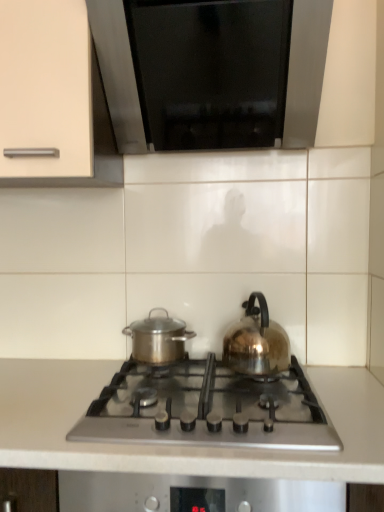
What do you see at coordinates (179, 446) in the screenshot?
I see `white matte countertop at center` at bounding box center [179, 446].

Locate an element on the screen. This screenshot has height=512, width=384. translucent glass kettle at right is located at coordinates (256, 341).

This screenshot has height=512, width=384. Describe the element at coordinates (158, 338) in the screenshot. I see `stainless steel pot at center` at that location.

The height and width of the screenshot is (512, 384). Find the location of `white matte countertop at center`. white matte countertop at center is located at coordinates (179, 446).

Between point (251, 325) and point (138, 375), which one is positioned in front?

Point (138, 375)

From the image's perspective, which is above, translucent glass kettle at right or satin silver gas stove at center?

translucent glass kettle at right is shown above in the image.

Considering the relative positions of translucent glass kettle at right and satin silver gas stove at center in the image provided, is translucent glass kettle at right to the right of satin silver gas stove at center from the viewer's perspective?

Correct, you'll find translucent glass kettle at right to the right of satin silver gas stove at center.

Is translucent glass kettle at right bigger or smaller than satin silver gas stove at center?

In the image, translucent glass kettle at right appears to be smaller than satin silver gas stove at center.

Can you confirm if white matte countertop at center is taller than translucent glass kettle at right?

Correct, white matte countertop at center is much taller as translucent glass kettle at right.

The image size is (384, 512). Find the location of `countertop that is below the translucent glass kettle at right (from the image's perspective)`. countertop that is below the translucent glass kettle at right (from the image's perspective) is located at coordinates (179, 446).

Looking at this image, measure the distance between white matte countertop at center and translucent glass kettle at right.

A distance of 11.67 inches exists between white matte countertop at center and translucent glass kettle at right.

In terms of width, does white matte countertop at center look wider or thinner when compared to translucent glass kettle at right?

In the image, white matte countertop at center appears to be wider than translucent glass kettle at right.

Which object is thinner, satin silver gas stove at center or white matte countertop at center?

With smaller width is satin silver gas stove at center.

Is satin silver gas stove at center behind white matte countertop at center?

Yes, satin silver gas stove at center is further from the camera.

From a real-world perspective, is satin silver gas stove at center located higher than white matte countertop at center?

Yes, from a real-world perspective, satin silver gas stove at center is over white matte countertop at center

Is satin silver gas stove at center bigger than white matte countertop at center?

No.

Can you tell me how much white matte countertop at center and stainless steel pot at center differ in facing direction?

The angle between the facing direction of white matte countertop at center and the facing direction of stainless steel pot at center is 0.628 degrees.

Does white matte countertop at center have a lesser width compared to stainless steel pot at center?

Incorrect, the width of white matte countertop at center is not less than that of stainless steel pot at center.

Where is `kitchen appliance lying above the white matte countertop at center (from the image's perspective)`? This screenshot has height=512, width=384. kitchen appliance lying above the white matte countertop at center (from the image's perspective) is located at coordinates (158, 338).

Does white matte countertop at center appear on the left side of stainless steel pot at center?

Yes.

Is stainless steel pot at center oriented away from white matte countertop at center?

No, white matte countertop at center is not at the back of stainless steel pot at center.

Which object is further away from the camera, stainless steel pot at center or white matte countertop at center?

stainless steel pot at center is further from the camera.

Does stainless steel pot at center have a lesser height compared to white matte countertop at center?

Indeed, stainless steel pot at center has a lesser height compared to white matte countertop at center.

Does point (345, 406) come behind point (120, 425)?

Yes.

From the picture: How many degrees apart are the facing directions of white matte countertop at center and satin silver gas stove at center?

The angular difference between white matte countertop at center and satin silver gas stove at center is 0.531 degrees.

Consider the image. Is white matte countertop at center wider or thinner than satin silver gas stove at center?

white matte countertop at center is wider than satin silver gas stove at center.

Locate an element on the screen. Image resolution: width=384 pixels, height=512 pixels. kettle lying behind the satin silver gas stove at center is located at coordinates tap(256, 341).

Looking at this image, from the image's perspective, is satin silver gas stove at center on translucent glass kettle at right?

No, from the image's perspective, satin silver gas stove at center is not above translucent glass kettle at right.

Is satin silver gas stove at center far from translucent glass kettle at right?

satin silver gas stove at center is actually quite close to translucent glass kettle at right.

Image resolution: width=384 pixels, height=512 pixels. I want to click on kettle above the satin silver gas stove at center (from the image's perspective), so click(x=256, y=341).

The height and width of the screenshot is (512, 384). Find the location of `kettle that is on the right side of white matte countertop at center`. kettle that is on the right side of white matte countertop at center is located at coordinates (256, 341).

When comparing their distances from white matte countertop at center, does translucent glass kettle at right or satin silver gas stove at center seem closer?

satin silver gas stove at center.

Estimate the real-world distances between objects in this image. Which object is closer to black glass at upper center, translucent glass kettle at right or satin silver gas stove at center?

The object closer to black glass at upper center is translucent glass kettle at right.

Which object lies nearer to the anchor point satin silver gas stove at center, black glass at upper center or stainless steel pot at center?

stainless steel pot at center.

From the image, which object appears to be nearer to stainless steel pot at center, white matte countertop at center or translucent glass kettle at right?

The object closer to stainless steel pot at center is translucent glass kettle at right.

Considering their positions, is satin silver gas stove at center positioned closer to black glass at upper center than white matte countertop at center?

The object closer to black glass at upper center is satin silver gas stove at center.

Looking at the image, which one is located further to stainless steel pot at center, translucent glass kettle at right or black glass at upper center?

The object further to stainless steel pot at center is black glass at upper center.

Estimate the real-world distances between objects in this image. Which object is closer to satin silver gas stove at center, white matte countertop at center or black glass at upper center?

Among the two, white matte countertop at center is located nearer to satin silver gas stove at center.

Based on their spatial positions, is black glass at upper center or stainless steel pot at center closer to white matte countertop at center?

stainless steel pot at center.

What are the coordinates of `kettle between black glass at upper center and satin silver gas stove at center vertically` in the screenshot? It's located at (256, 341).

Identify the location of kitchen appliance between translucent glass kettle at right and white matte countertop at center in the up-down direction. (158, 338).

You are a GUI agent. You are given a task and a screenshot of the screen. Output one action in this format:
    pyautogui.click(x=<x>, y=<y>)
    Task: Click on the kettle between black glass at upper center and white matte countertop at center vertically
    This screenshot has width=384, height=512.
    Given the screenshot: What is the action you would take?
    pyautogui.click(x=256, y=341)

You are a GUI agent. You are given a task and a screenshot of the screen. Output one action in this format:
    pyautogui.click(x=<x>, y=<y>)
    Task: Click on the gas stove between white matte countertop at center and stainless steel pot at center in the front-back direction
    
    Given the screenshot: What is the action you would take?
    pos(207,408)